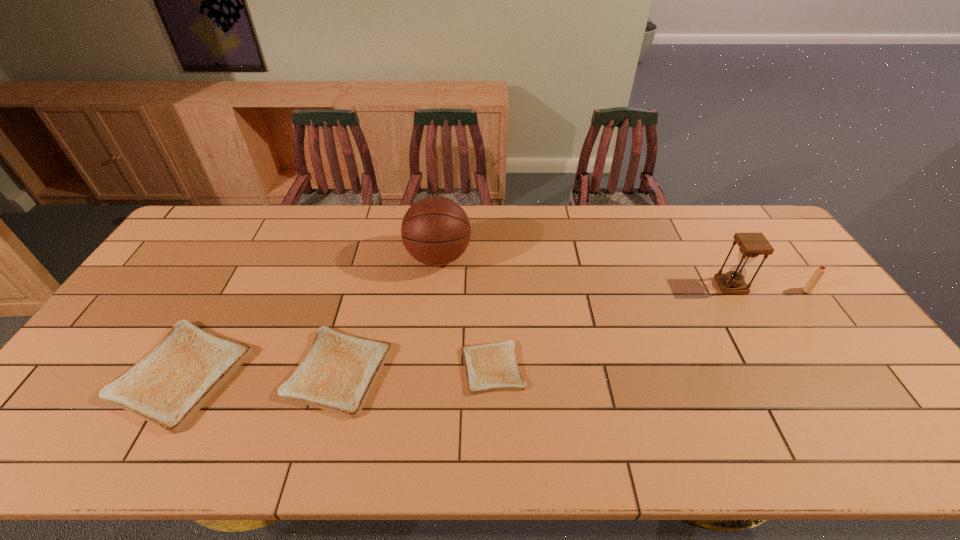
Locate an element on the screen. the leftmost toast is located at coordinates (167, 387).

Identify the location of the second shortest toast. (338, 372).

At what (x,y) coordinates should I click in order to perform the action: click on the second toast from left to right. Please return your answer as a coordinate pair (x, y). Looking at the image, I should click on (338, 372).

Locate an element on the screen. the shortest object is located at coordinates (490, 367).

At what (x,y) coordinates should I click in order to perform the action: click on the shortest toast. Please return your answer as a coordinate pair (x, y). This screenshot has height=540, width=960. Looking at the image, I should click on (490, 367).

Where is `hourglass`? The width and height of the screenshot is (960, 540). hourglass is located at coordinates (751, 245).

Find the location of a particular element. The width and height of the screenshot is (960, 540). the second object from right to left is located at coordinates (751, 245).

Identify the location of basketball. (435, 230).

At what (x,y) coordinates should I click in order to perform the action: click on the third tallest object. Please return your answer as a coordinate pair (x, y). The height and width of the screenshot is (540, 960). Looking at the image, I should click on [820, 271].

This screenshot has height=540, width=960. Identify the location of the rightmost object. (820, 271).